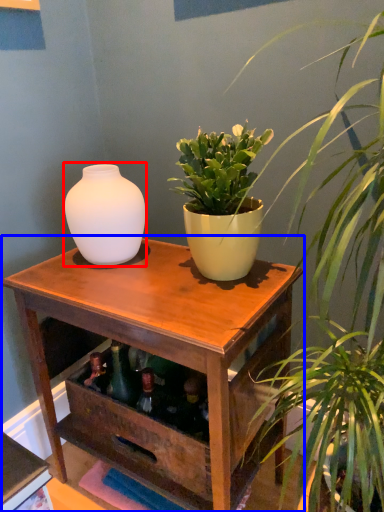
Question: Among these objects, which one is nearest to the camera, vase (highlighted by a red box) or table (highlighted by a blue box)?

Choices:
 (A) vase
 (B) table

Answer: (B)